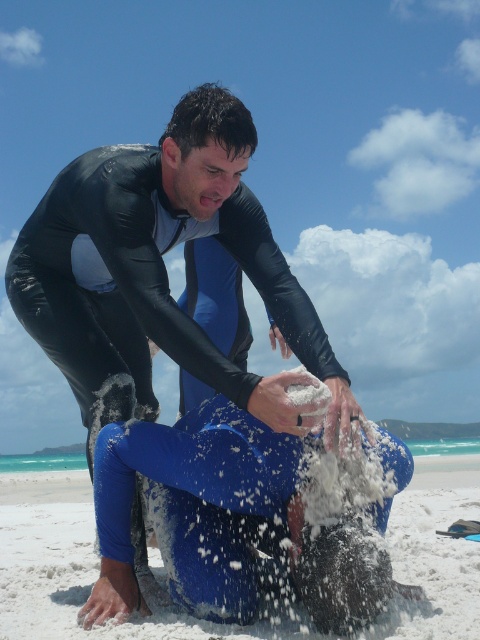
Question: Which point is farther from the camera taking this photo?

Choices:
 (A) (108, 177)
 (B) (414, 570)

Answer: (B)

Question: Can you confirm if black wetsuit at center is bigger than blue fabric at lower center?

Choices:
 (A) no
 (B) yes

Answer: (A)

Question: Is black wetsuit at center wider than blue fabric at lower center?

Choices:
 (A) no
 (B) yes

Answer: (A)

Question: Can you confirm if black wetsuit at center is positioned to the right of blue fabric at lower center?

Choices:
 (A) no
 (B) yes

Answer: (A)